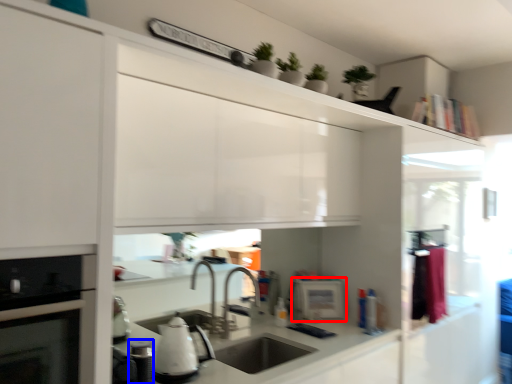
Question: Which object appears farthest to the camera in this image, appliance (highlighted by a red box) or appliance (highlighted by a blue box)?

Choices:
 (A) appliance
 (B) appliance

Answer: (A)